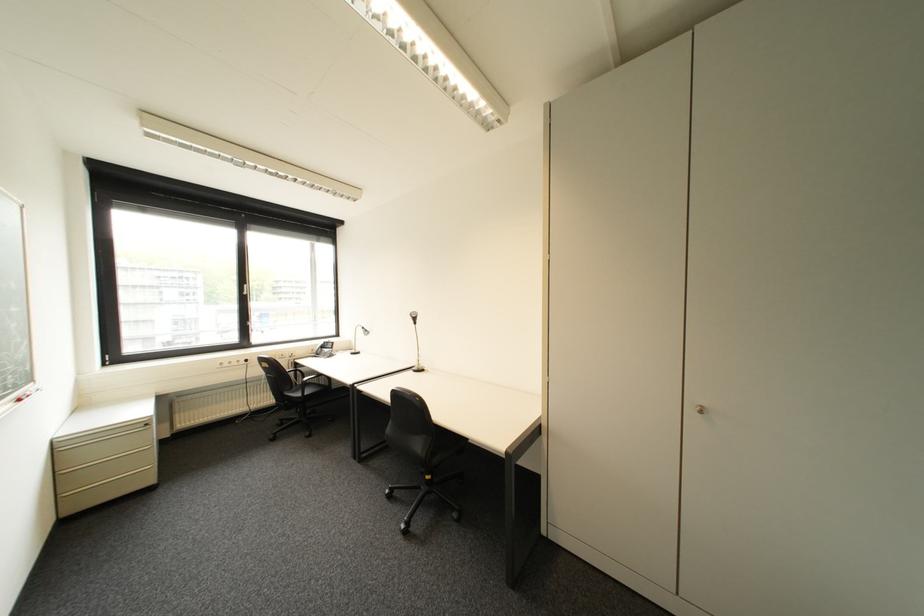
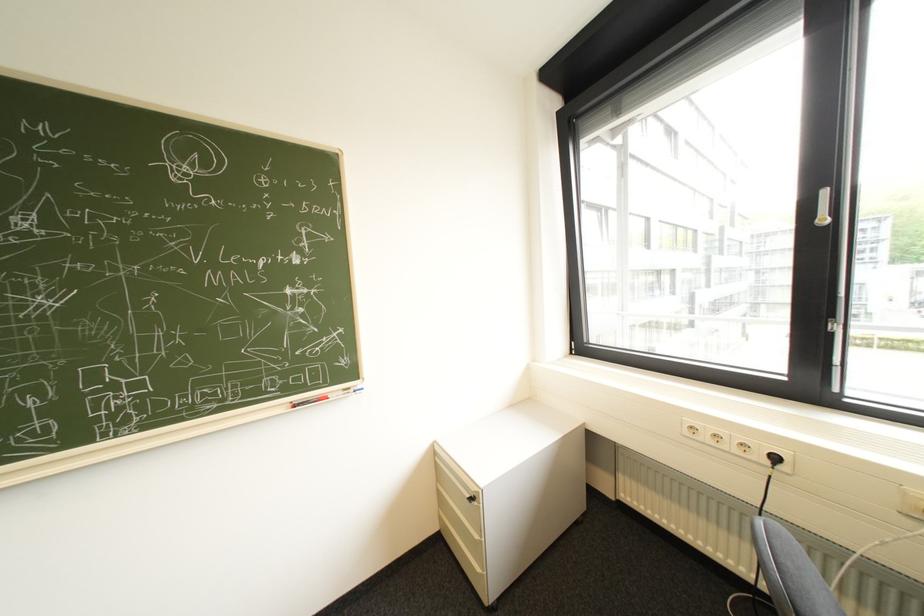
Locate, in the second image, the point that corresponds to [157,424] in the first image.

(482, 499)